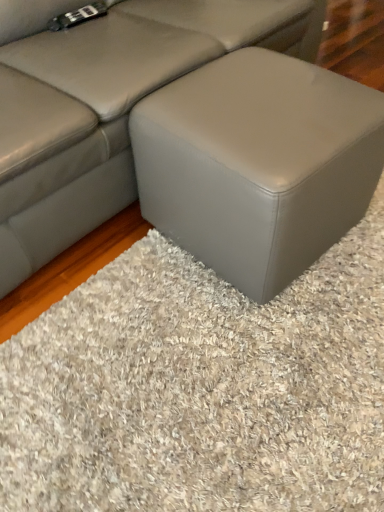
Question: Looking at their shapes, would you say matte gray ottoman at center is wider or thinner than matte gray ottoman at center?

Choices:
 (A) wide
 (B) thin

Answer: (A)

Question: Is matte gray ottoman at center spatially inside matte gray ottoman at center, or outside of it?

Choices:
 (A) outside
 (B) inside

Answer: (A)

Question: Which of these objects is positioned farthest from the matte gray ottoman at center?

Choices:
 (A) matte gray ottoman at center
 (B) gray matte ottoman at center

Answer: (B)

Question: Which is farther from the matte gray ottoman at center?

Choices:
 (A) matte gray ottoman at center
 (B) gray matte ottoman at center

Answer: (B)